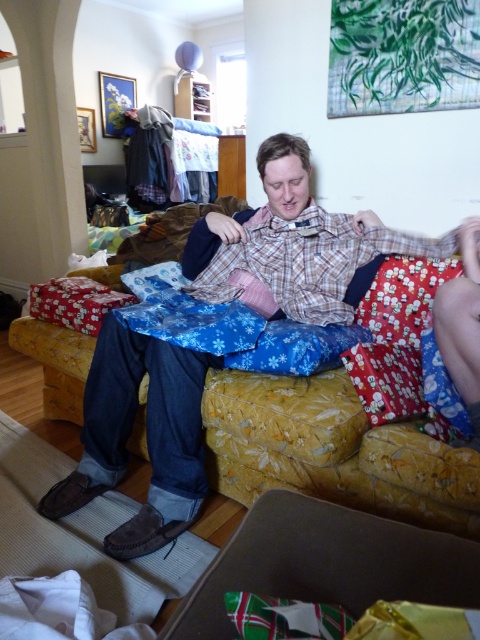
Measure the distance between yellow floral fabric couch at center and green paper gift at lower center.

They are 16.96 inches apart.

Between point (27, 353) and point (344, 561), which one is positioned in front?

Point (344, 561)

The width and height of the screenshot is (480, 640). What do you see at coordinates (333, 451) in the screenshot? I see `yellow floral fabric couch at center` at bounding box center [333, 451].

The image size is (480, 640). I want to click on yellow floral fabric couch at center, so click(x=333, y=451).